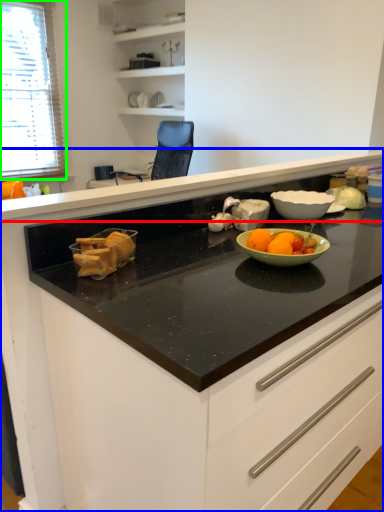
Question: Which is nearer to the countertop (highlighted by a red box)? cabinetry (highlighted by a blue box) or window (highlighted by a green box).

Choices:
 (A) cabinetry
 (B) window

Answer: (A)